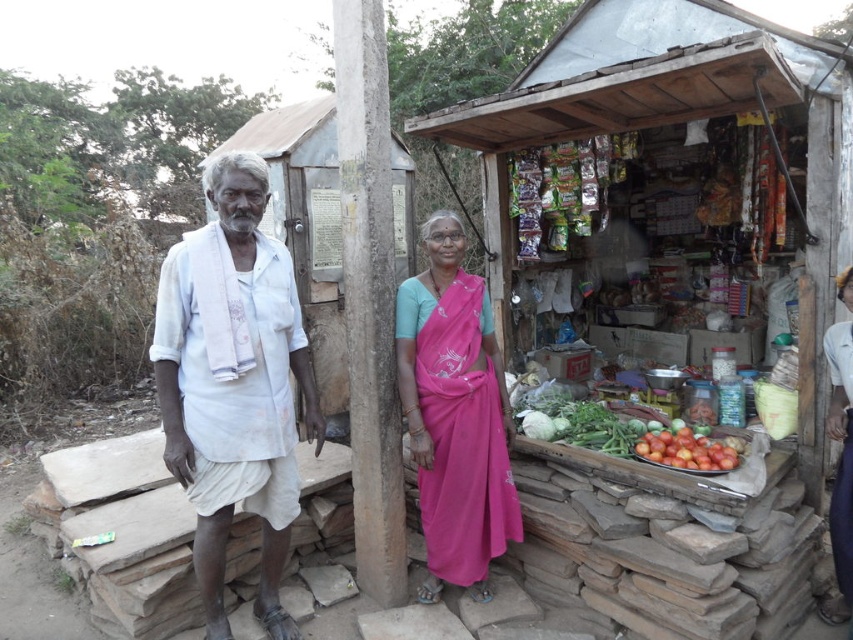
You are a traveler who just arrived at the rural market. You notice the white cotton shirt at left. Where exactly is it positioned in relation to the makeshift shop?

The white cotton shirt at left is located at point 0.600 in the x coordinate and 0.274 in the y coordinate relative to the makeshift shop.

You are a customer at the rural market stall. You notice a point at coordinates (233,384). Which object is this point located on?

The point at (233,384) is located on the white cotton shirt at left.

You are a customer at the rural market stall. You see the pink silk saree at center and the shiny red tomatoes at center. Which item is positioned higher up?

The pink silk saree at center is located above the shiny red tomatoes at center, so the saree is positioned higher up.